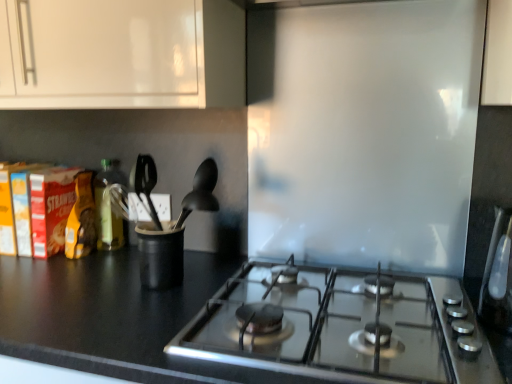
Describe the element at coordinates (123, 54) in the screenshot. I see `white glossy cabinet at upper left` at that location.

The image size is (512, 384). Describe the element at coordinates (200, 192) in the screenshot. I see `black matte spoon at center` at that location.

What do you see at coordinates (160, 255) in the screenshot? The width and height of the screenshot is (512, 384). I see `black plastic utensil holder at center` at bounding box center [160, 255].

Where is `green glass bottle at left`? The height and width of the screenshot is (384, 512). green glass bottle at left is located at coordinates (109, 208).

The height and width of the screenshot is (384, 512). Identify the location of white glossy cabinet at upper left. (123, 54).

Are green glass bottle at left and black plastic utensil holder at center located far from each other?

No, there isn't a large distance between green glass bottle at left and black plastic utensil holder at center.

Can you tell me how much green glass bottle at left and black plastic utensil holder at center differ in facing direction?

They differ by 0.00572 degrees in their facing directions.

Does green glass bottle at left come in front of black plastic utensil holder at center?

No, it is not.

Which of these two, green glass bottle at left or black plastic utensil holder at center, is wider?

black plastic utensil holder at center.

Could black matte spoon at center be considered to be inside satin silver toaster at right?

That's incorrect, black matte spoon at center is not inside satin silver toaster at right.

Between satin silver toaster at right and black matte spoon at center, which one has smaller width?

Thinner between the two is black matte spoon at center.

Considering the points (502, 240) and (193, 205), which point is in front, point (502, 240) or point (193, 205)?

The point (502, 240) is more forward.

From a real-world perspective, which is physically above, satin silver toaster at right or black matte spoon at center?

black matte spoon at center, from a real-world perspective.

Between satin silver toaster at right and black matte countertop at lower left, which one has larger width?

Wider between the two is black matte countertop at lower left.

Is satin silver toaster at right in front of black matte countertop at lower left?

No, it is behind black matte countertop at lower left.

Consider the image. From the image's perspective, which is below, satin silver toaster at right or black matte countertop at lower left?

From the image's view, black matte countertop at lower left is below.

Is satin silver toaster at right to the right of black matte countertop at lower left from the viewer's perspective?

Yes, satin silver toaster at right is to the right of black matte countertop at lower left.

In the scene shown: Can you confirm if black matte spoon at center is taller than satin silver toaster at right?

No.

Considering the positions of objects black matte spoon at center and satin silver toaster at right in the image provided, who is more to the left, black matte spoon at center or satin silver toaster at right?

black matte spoon at center is more to the left.

Is black plastic utensil holder at center beside green glass bottle at left?

They are not placed beside each other.

Is black plastic utensil holder at center to the left or to the right of green glass bottle at left in the image?

Clearly, black plastic utensil holder at center is on the right of green glass bottle at left in the image.

From a real-world perspective, is black plastic utensil holder at center positioned above or below green glass bottle at left?

black plastic utensil holder at center is situated lower than green glass bottle at left in the real world.

At what (x,y) coordinates should I click in order to perform the action: click on appliance beneath the black matte spoon at center (from a real-world perspective). Please return your answer as a coordinate pair (x, y). The height and width of the screenshot is (384, 512). Looking at the image, I should click on (160, 255).

Would you say black matte spoon at center contains black plastic utensil holder at center?

No, black plastic utensil holder at center is not surrounded by black matte spoon at center.

Is black matte spoon at center positioned far away from black plastic utensil holder at center?

That's not correct — black matte spoon at center is a little close to black plastic utensil holder at center.

Is white glossy cabinet at upper left touching black matte spoon at center?

No, white glossy cabinet at upper left is not making contact with black matte spoon at center.

Is white glossy cabinet at upper left at the right side of black matte spoon at center?

In fact, white glossy cabinet at upper left is to the left of black matte spoon at center.

Which of these two, white glossy cabinet at upper left or black matte spoon at center, is wider?

Wider between the two is white glossy cabinet at upper left.

From the image's perspective, which one is positioned lower, white glossy cabinet at upper left or black matte spoon at center?

black matte spoon at center is shown below in the image.

This screenshot has width=512, height=384. I want to click on bottle on the left of black plastic utensil holder at center, so click(109, 208).

The image size is (512, 384). Find the location of `silverware behind the satin silver toaster at right`. silverware behind the satin silver toaster at right is located at coordinates (200, 192).

Which object lies nearer to the anchor point green glass bottle at left, black matte spoon at center or black plastic utensil holder at center?

black matte spoon at center is positioned closer to the anchor green glass bottle at left.

Estimate the real-world distances between objects in this image. Which object is closer to white glossy cabinet at upper left, satin silver toaster at right or black plastic utensil holder at center?

Based on the image, black plastic utensil holder at center appears to be nearer to white glossy cabinet at upper left.

Which object lies further to the anchor point black matte countertop at lower left, green glass bottle at left or black plastic utensil holder at center?

Based on the image, green glass bottle at left appears to be further to black matte countertop at lower left.

Looking at the image, which one is located closer to green glass bottle at left, white glossy cabinet at upper left or black matte spoon at center?

Among the two, black matte spoon at center is located nearer to green glass bottle at left.

Estimate the real-world distances between objects in this image. Which object is further from white glossy cabinet at upper left, green glass bottle at left or black matte spoon at center?

The object further to white glossy cabinet at upper left is green glass bottle at left.

Looking at the image, which one is located further to black plastic utensil holder at center, green glass bottle at left or black matte countertop at lower left?

green glass bottle at left.

From the image, which object appears to be farther from black plastic utensil holder at center, black matte countertop at lower left or black matte spoon at center?

black matte countertop at lower left.

Which object lies nearer to the anchor point black matte countertop at lower left, satin silver toaster at right or black plastic utensil holder at center?

black plastic utensil holder at center is closer to black matte countertop at lower left.

At what (x,y) coordinates should I click in order to perform the action: click on appliance situated between green glass bottle at left and satin silver toaster at right from left to right. Please return your answer as a coordinate pair (x, y). The image size is (512, 384). Looking at the image, I should click on tap(160, 255).

Where is `countertop located between black matte spoon at center and satin silver toaster at right in the left-right direction`? countertop located between black matte spoon at center and satin silver toaster at right in the left-right direction is located at coordinates (113, 317).

Where is `bottle that lies between white glossy cabinet at upper left and black matte countertop at lower left from top to bottom`? bottle that lies between white glossy cabinet at upper left and black matte countertop at lower left from top to bottom is located at coordinates (109, 208).

Where is `appliance located between green glass bottle at left and black matte spoon at center in the left-right direction`? This screenshot has width=512, height=384. appliance located between green glass bottle at left and black matte spoon at center in the left-right direction is located at coordinates (160, 255).